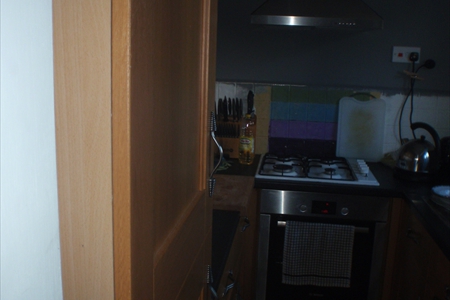
Locate an element on the screen. The image size is (450, 300). silver range hood is located at coordinates (287, 22).